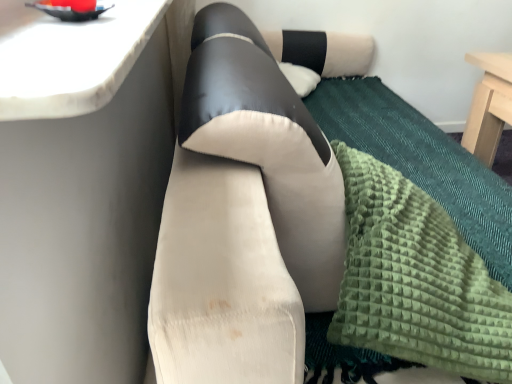
Question: Which is correct: suede-like beige couch at center is inside white marble countertop at upper left, or outside of it?

Choices:
 (A) outside
 (B) inside

Answer: (A)

Question: Is suede-like beige couch at center bigger or smaller than white marble countertop at upper left?

Choices:
 (A) big
 (B) small

Answer: (A)

Question: Which is nearer to the white marble countertop at upper left?

Choices:
 (A) green textured blanket at lower right
 (B) suede-like beige couch at center

Answer: (B)

Question: Estimate the real-world distances between objects in this image. Which object is farther from the green textured blanket at lower right?

Choices:
 (A) suede-like beige couch at center
 (B) white marble countertop at upper left

Answer: (B)